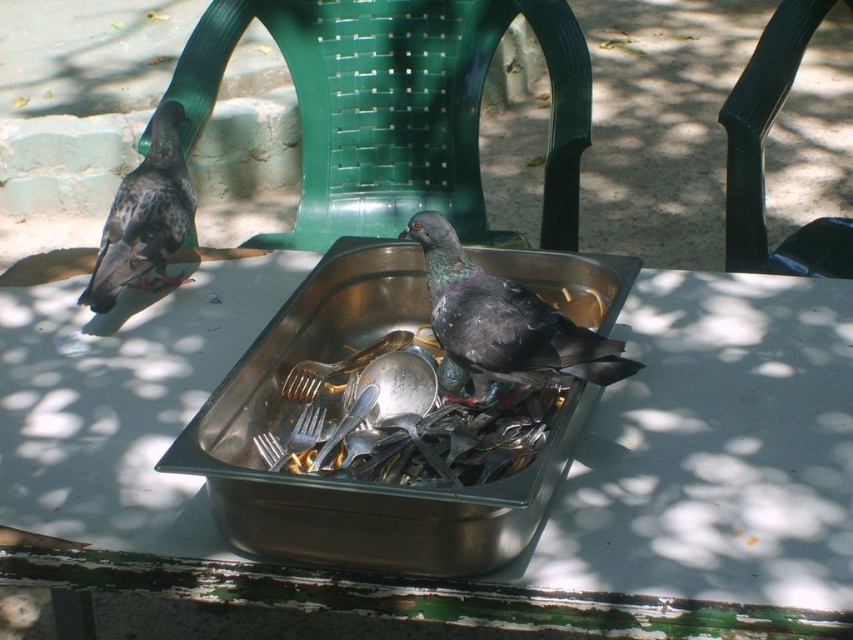
Question: Is green plastic chair at upper center to the left of shiny dark gray bird at center from the viewer's perspective?

Choices:
 (A) no
 (B) yes

Answer: (B)

Question: Is shiny dark gray bird at center to the right of speckled feather pigeon at upper left from the viewer's perspective?

Choices:
 (A) yes
 (B) no

Answer: (A)

Question: Does black plastic chair at upper right have a larger size compared to speckled feather pigeon at upper left?

Choices:
 (A) yes
 (B) no

Answer: (A)

Question: Which point is closer to the camera?

Choices:
 (A) speckled feather pigeon at upper left
 (B) black plastic chair at upper right
 (C) shiny dark gray bird at center
 (D) stainless steel sink at center

Answer: (D)

Question: Estimate the real-world distances between objects in this image. Which object is farther from the stainless steel tray at center?

Choices:
 (A) black plastic chair at upper right
 (B) brushed metal spoon at center
 (C) shiny dark gray bird at center

Answer: (A)

Question: Among these objects, which one is farthest from the camera?

Choices:
 (A) black plastic chair at upper right
 (B) stainless steel tray at center

Answer: (A)